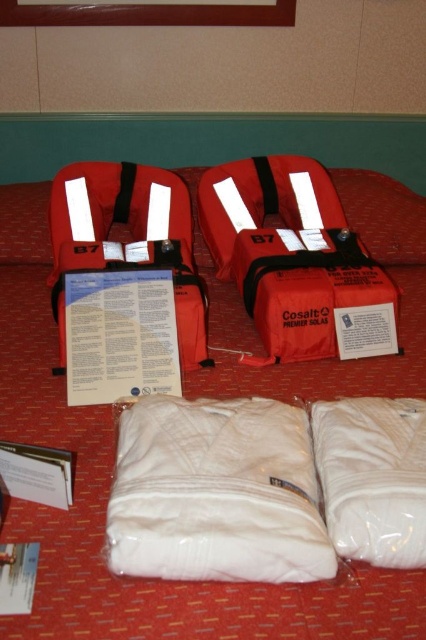
Question: Observing the image, what is the correct spatial positioning of white cotton sleeping bag at lower center in reference to matte red life jacket at center?

Choices:
 (A) right
 (B) left

Answer: (A)

Question: Can you confirm if matte red life jackets at center is smaller than white soft sleeping bag at lower right?

Choices:
 (A) no
 (B) yes

Answer: (A)

Question: Can you confirm if white cotton sleeping bag at lower center is wider than matte red life jacket at center?

Choices:
 (A) yes
 (B) no

Answer: (B)

Question: Which point appears closest to the camera in this image?

Choices:
 (A) coord(60,240)
 (B) coord(155,449)

Answer: (B)

Question: Which point is farther to the camera?

Choices:
 (A) white cotton sleeping bag at lower center
 (B) matte red life jackets at center

Answer: (A)

Question: Which point is farther to the camera?

Choices:
 (A) (92, 435)
 (B) (371, 556)

Answer: (A)